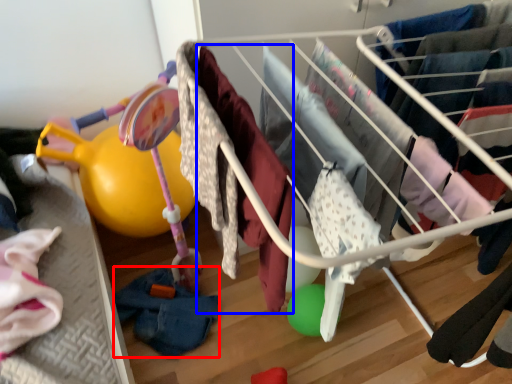
Question: Which object appears closest to the camera in this image, clothing (highlighted by a red box) or clothing (highlighted by a blue box)?

Choices:
 (A) clothing
 (B) clothing

Answer: (B)